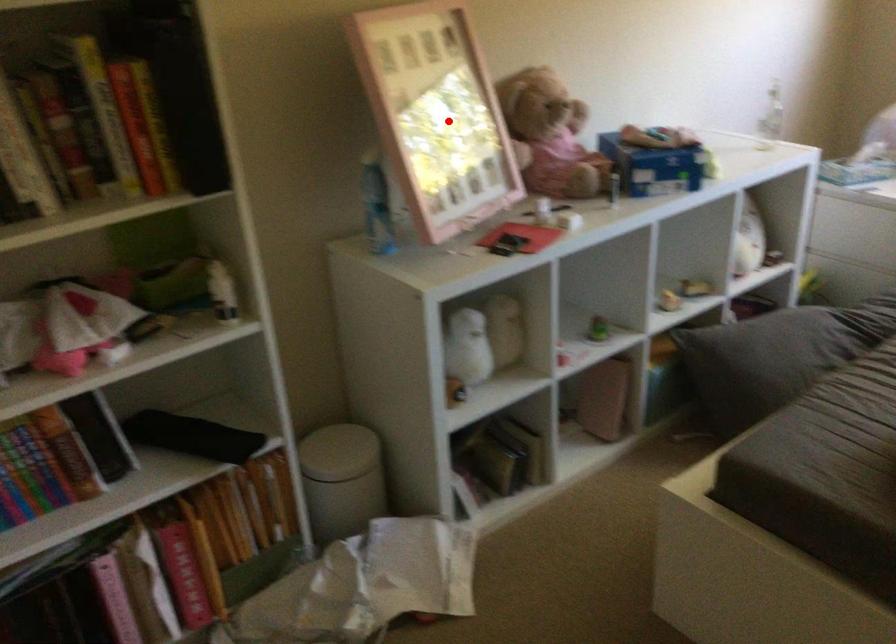
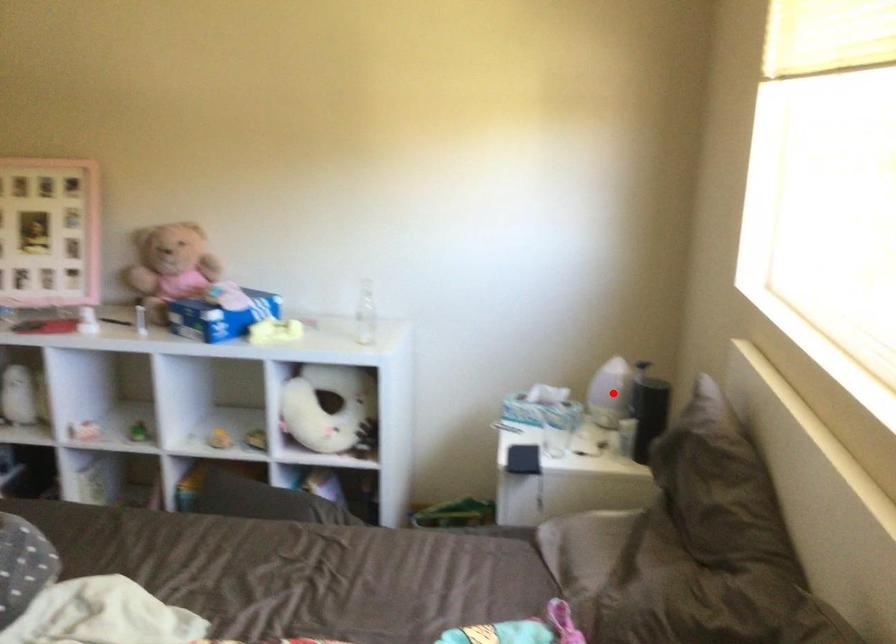
I am providing you with two images of the same scene from different viewpoints. A red point is marked on the first image and another point is marked on the second image. Is the marked point in image1 the same physical position as the marked point in image2?

No